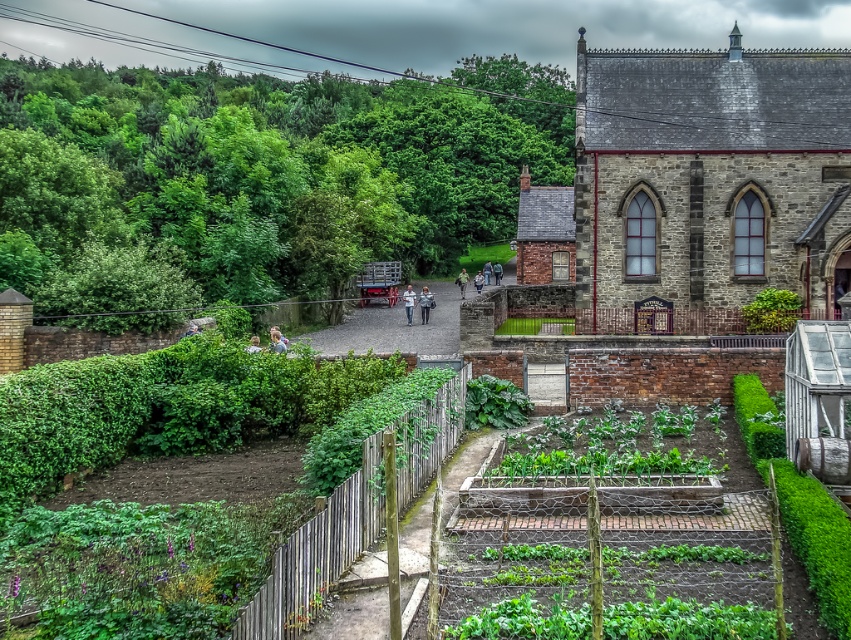
How far apart are green leafy hedge at upper left and gray stone church at upper right?

green leafy hedge at upper left and gray stone church at upper right are 121.03 feet apart from each other.

Find the location of a particular element. green leafy hedge at upper left is located at coordinates (256, 179).

At what (x,y) coordinates should I click in order to perform the action: click on green leafy hedge at upper left. Please return your answer as a coordinate pair (x, y). The height and width of the screenshot is (640, 851). Looking at the image, I should click on (256, 179).

Which is behind, point (786, 115) or point (400, 381)?

Positioned behind is point (786, 115).

Between gray stone church at upper right and green wooden fence at lower center, which one appears on the right side from the viewer's perspective?

Positioned to the right is gray stone church at upper right.

This screenshot has width=851, height=640. What are the coordinates of `gray stone church at upper right` in the screenshot? It's located at [x=710, y=173].

Is point (311, 209) in front of point (807, 557)?

No.

Can you confirm if green leafy hedge at upper left is thinner than green wooden fence at lower center?

No, green leafy hedge at upper left is not thinner than green wooden fence at lower center.

Does point (201, 189) come closer to viewer compared to point (746, 408)?

No.

The image size is (851, 640). I want to click on green leafy hedge at upper left, so click(x=256, y=179).